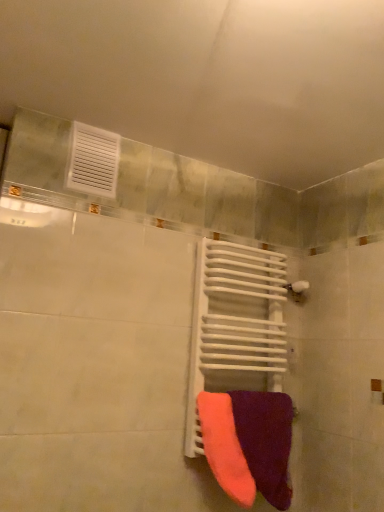
Question: Does neon orange fabric towel at center, which is the second towel from right to left, have a greater height compared to white metallic radiator at center?

Choices:
 (A) no
 (B) yes

Answer: (A)

Question: Can you confirm if neon orange fabric towel at center, which is the second towel from right to left, is positioned to the left of white metallic radiator at center?

Choices:
 (A) no
 (B) yes

Answer: (B)

Question: Does neon orange fabric towel at center, which is the second towel from right to left, have a lesser height compared to white metallic radiator at center?

Choices:
 (A) yes
 (B) no

Answer: (A)

Question: Is neon orange fabric towel at center, which is the first towel from left to right, in front of white metallic radiator at center?

Choices:
 (A) yes
 (B) no

Answer: (A)

Question: Considering the relative sizes of neon orange fabric towel at center, which is the first towel from left to right, and white metallic radiator at center in the image provided, is neon orange fabric towel at center, which is the first towel from left to right, bigger than white metallic radiator at center?

Choices:
 (A) yes
 (B) no

Answer: (B)

Question: From a real-world perspective, is neon orange fabric towel at center, which is the first towel from left to right, below white metallic radiator at center?

Choices:
 (A) no
 (B) yes

Answer: (B)

Question: Is white metallic radiator at center closer to camera compared to neon orange fabric towel at center, which is the second towel from right to left?

Choices:
 (A) no
 (B) yes

Answer: (A)

Question: From a real-world perspective, does white metallic radiator at center stand above neon orange fabric towel at center, which is the first towel from left to right?

Choices:
 (A) yes
 (B) no

Answer: (A)

Question: Considering the relative positions of white metallic radiator at center and neon orange fabric towel at center, which is the first towel from left to right, in the image provided, is white metallic radiator at center to the left of neon orange fabric towel at center, which is the first towel from left to right, from the viewer's perspective?

Choices:
 (A) no
 (B) yes

Answer: (A)

Question: Is white metallic radiator at center bigger than neon orange fabric towel at center, which is the first towel from left to right?

Choices:
 (A) yes
 (B) no

Answer: (A)

Question: From a real-world perspective, is white metallic radiator at center below neon orange fabric towel at center, which is the second towel from right to left?

Choices:
 (A) no
 (B) yes

Answer: (A)

Question: Can you confirm if white metallic radiator at center is taller than neon orange fabric towel at center, which is the second towel from right to left?

Choices:
 (A) yes
 (B) no

Answer: (A)

Question: Can you confirm if velvet purple towel at lower right, arranged as the 1th towel when viewed from the right, is positioned to the left of neon orange fabric towel at center, which is the second towel from right to left?

Choices:
 (A) no
 (B) yes

Answer: (A)